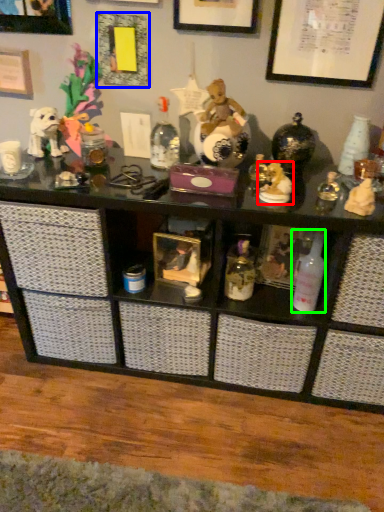
Question: Which is farther away from toy (highlighted by a red box)? picture frame (highlighted by a blue box) or bottle (highlighted by a green box)?

Choices:
 (A) picture frame
 (B) bottle

Answer: (A)